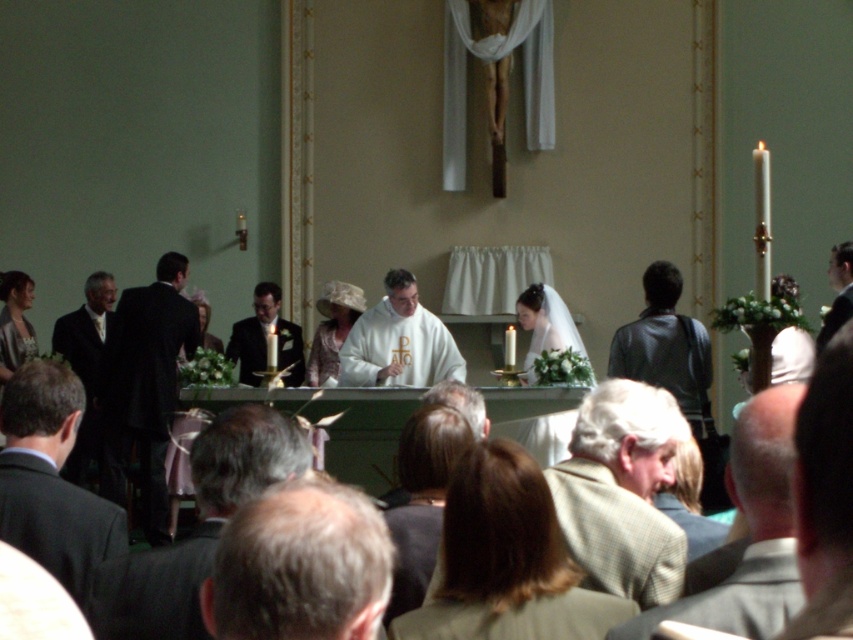
Who is higher up, dark suit at left or matte white dress at left?

matte white dress at left is above.

Is dark suit at left below matte white dress at left?

Yes, dark suit at left is below matte white dress at left.

Is point (175, 305) closer to camera compared to point (27, 285)?

Yes, point (175, 305) is in front of point (27, 285).

In order to click on dark suit at left in this screenshot , I will do 144,385.

Looking at this image, is black suit at lower left to the right of light beige lace dress at center from the viewer's perspective?

No, black suit at lower left is not to the right of light beige lace dress at center.

Where is `black suit at lower left`? The height and width of the screenshot is (640, 853). black suit at lower left is located at coordinates click(51, 480).

The width and height of the screenshot is (853, 640). I want to click on black suit at lower left, so click(x=51, y=480).

Between light brown wool coat at center and light beige lace dress at center, which one is positioned higher?

light beige lace dress at center is higher up.

Can you confirm if light brown wool coat at center is thinner than light beige lace dress at center?

No, light brown wool coat at center is not thinner than light beige lace dress at center.

Is point (612, 456) positioned before point (318, 348)?

Yes.

Where is `light brown wool coat at center`? The image size is (853, 640). light brown wool coat at center is located at coordinates (621, 492).